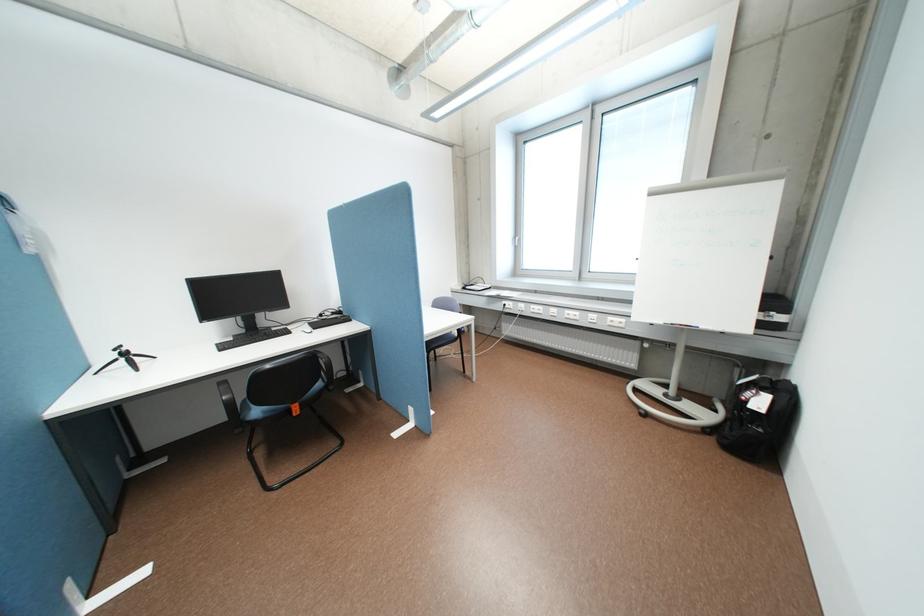
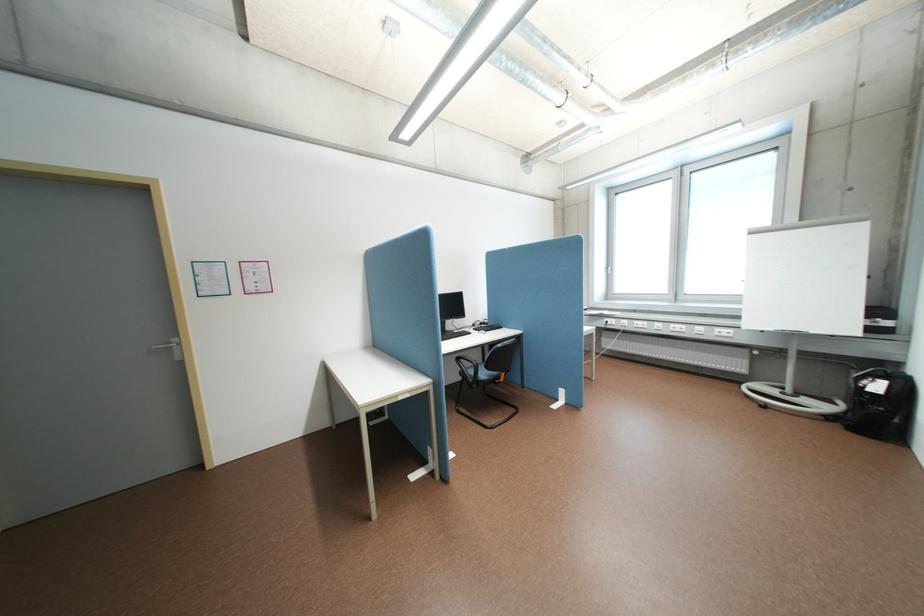
In the second image, find the point that corresponds to point (723, 439) in the first image.

(848, 424)